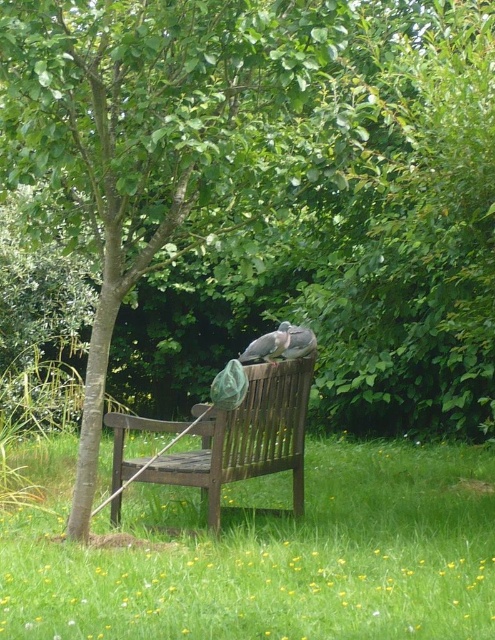
Question: Is gray matte pigeon at center thinner than gray feathered pigeon at center?

Choices:
 (A) no
 (B) yes

Answer: (A)

Question: In this image, where is wooden bench at center located relative to gray matte pigeon at center?

Choices:
 (A) below
 (B) above

Answer: (A)

Question: Which point is closer to the camera taking this photo?

Choices:
 (A) [x=252, y=349]
 (B) [x=320, y=612]
 (C) [x=219, y=435]
 (D) [x=289, y=352]

Answer: (B)

Question: Which point appears farthest from the camera in this image?

Choices:
 (A) (271, 333)
 (B) (313, 340)

Answer: (B)

Question: Which object is closer to the camera taking this photo?

Choices:
 (A) wooden bench at center
 (B) gray feathered pigeon at center
 (C) gray matte pigeon at center
 (D) green grass at center

Answer: (D)

Question: Does wooden bench at center appear on the right side of gray feathered pigeon at center?

Choices:
 (A) yes
 (B) no

Answer: (B)